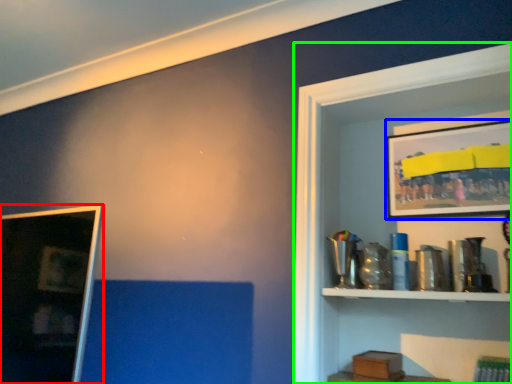
Question: Which object is positioned closest to picture frame (highlighted by a red box)? Select from picture frame (highlighted by a blue box) and shelf (highlighted by a green box).

Choices:
 (A) picture frame
 (B) shelf

Answer: (B)